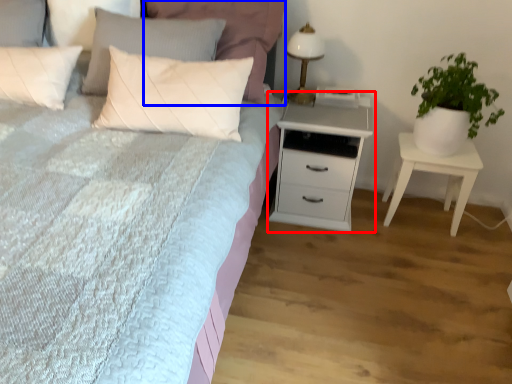
Question: Which of the following is the closest to the observer, chest of drawers (highlighted by a red box) or pillow (highlighted by a blue box)?

Choices:
 (A) chest of drawers
 (B) pillow

Answer: (B)